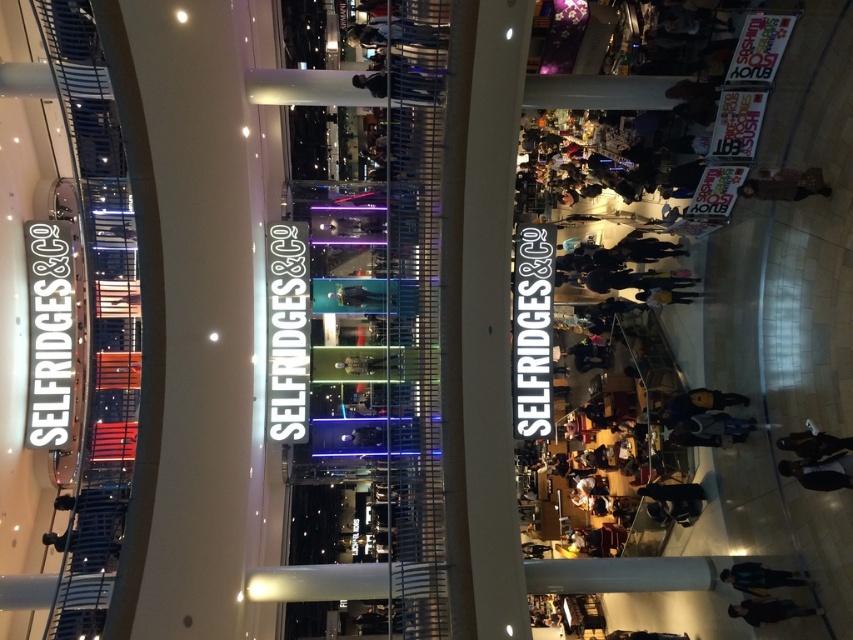
Question: Does dark gray sweater at center come behind dark blue jacket at lower right?

Choices:
 (A) yes
 (B) no

Answer: (A)

Question: Which object is positioned closest to the leather jacket at lower right?

Choices:
 (A) dark gray sweater at center
 (B) dark gray jacket at lower center
 (C) metallic silver escalator at left
 (D) dark blue jeans at lower right

Answer: (D)

Question: Which is nearer to the dark blue jacket at lower right?

Choices:
 (A) leather jacket at lower right
 (B) dark gray jacket at lower center
 (C) dark blue jeans at lower right
 (D) metallic silver escalator at left

Answer: (B)

Question: Where is dark gray jacket at lower center located in relation to leather jacket at lower right in the image?

Choices:
 (A) above
 (B) below

Answer: (B)

Question: Is metallic silver escalator at left above dark blue jacket at lower right?

Choices:
 (A) no
 (B) yes

Answer: (B)

Question: Which object is farther from the camera taking this photo?

Choices:
 (A) dark blue jacket at lower right
 (B) dark gray jacket at lower center
 (C) dark blue jeans at lower right

Answer: (A)